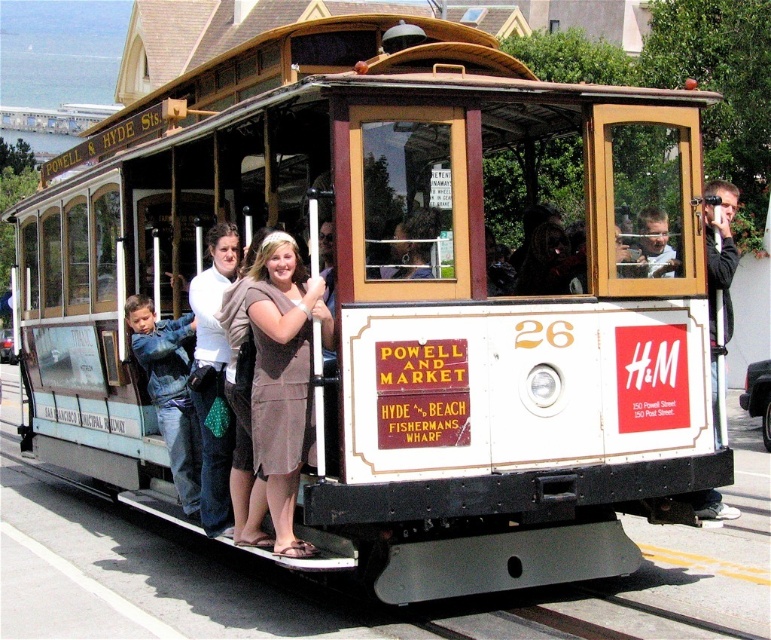
You are a photographer standing on the cable car and want to take a photo of the matte brown dress at center without the matte black camera at center blocking the view. Can you adjust your position to do so?

The matte brown dress at center is located below the matte black camera at center. Therefore, you can lower your camera angle to capture the matte brown dress at center while avoiding the matte black camera at center.

You are standing at the point marked as point (302,413). The cable car is 5.90 meters away from you. If you want to take a photo of the cable car from here, will you be able to capture the entire cable car in your shot without moving? Explain your reasoning.

The distance between you and the cable car is 5.90 meters. Whether the entire cable car fits in the photo depends on your camera lens. A standard lens might require adjusting your position or zoom, but since you can only stay at the point, ensure your camera has a wide enough angle to include the entire cable car from that distance.